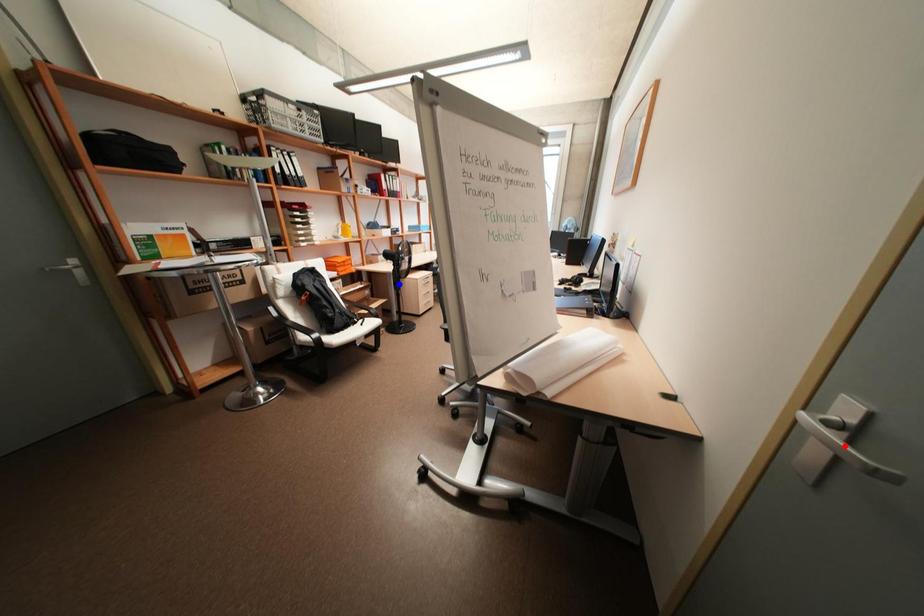
Question: In the image, two points are highlighted. Which point is nearer to the camera? Reply with the corresponding letter.

Choices:
 (A) blue point
 (B) red point

Answer: (B)